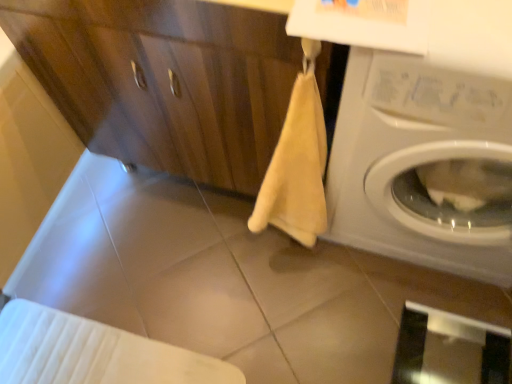
Find the location of `vacant space situated on the left part of transparent glass screen door at lower right`. vacant space situated on the left part of transparent glass screen door at lower right is located at coordinates (344, 340).